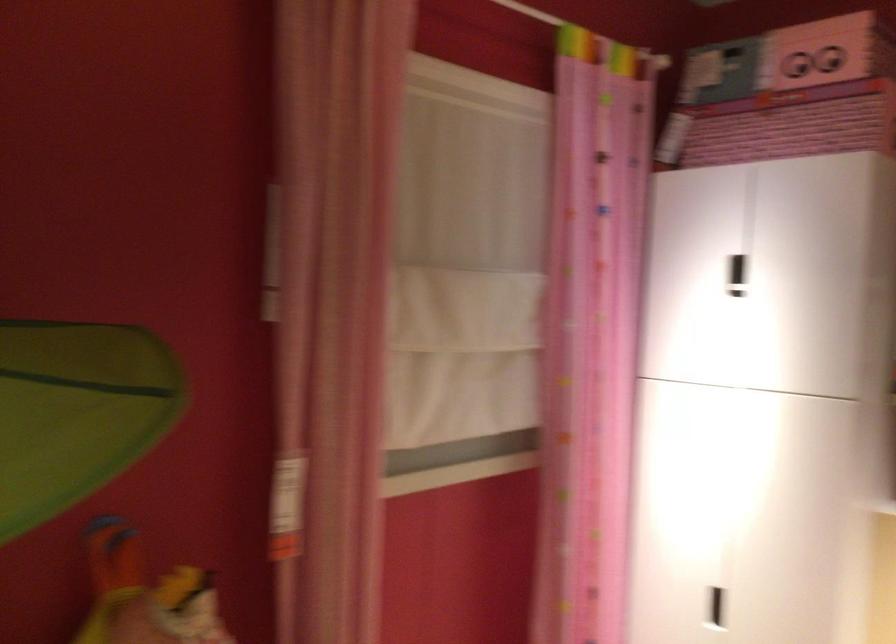
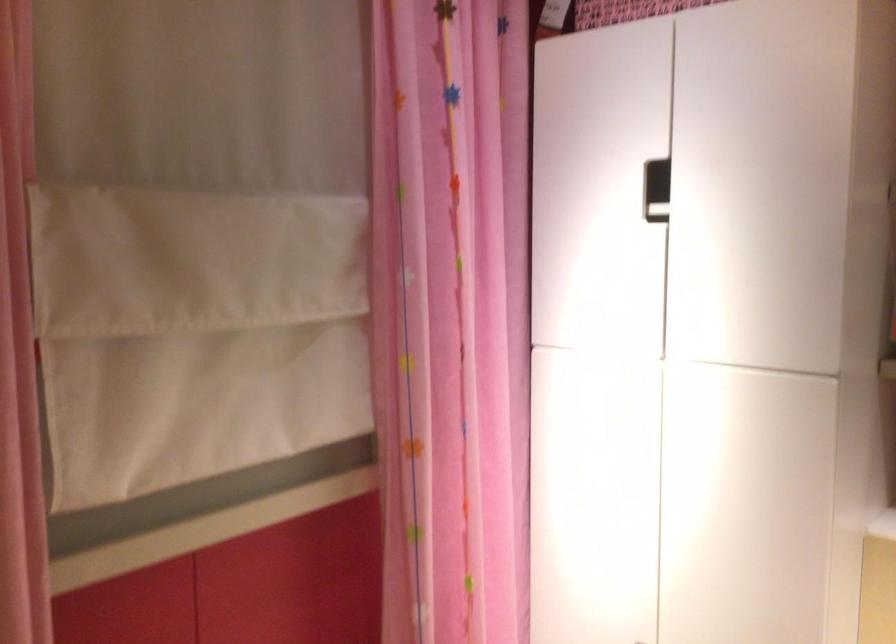
What movement of the cameraman would produce the second image?

The movement direction of the cameraman is right, forward.